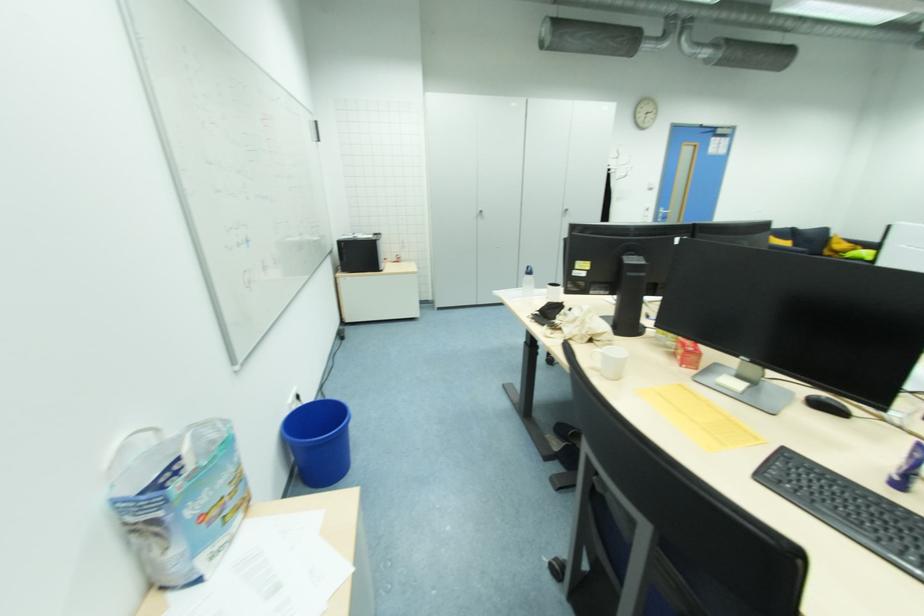
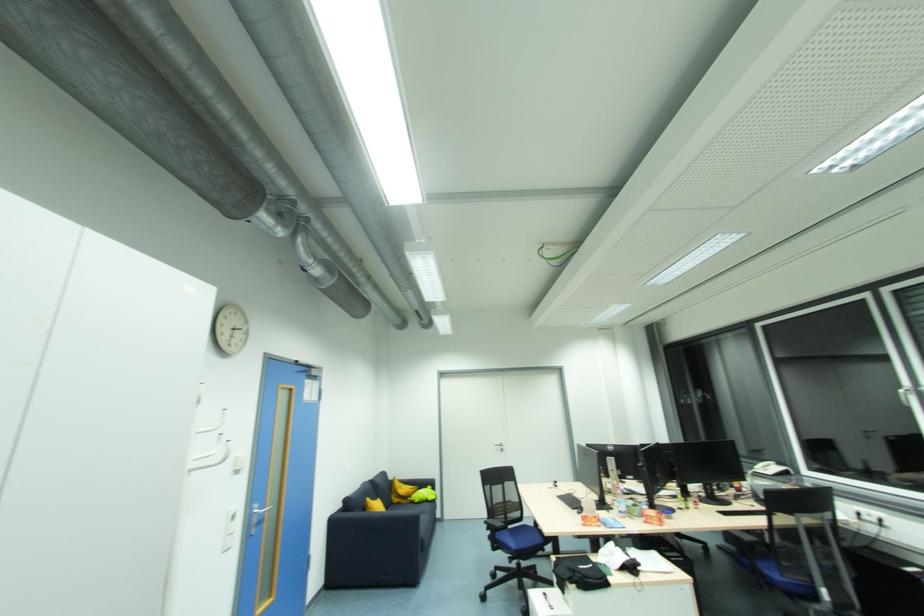
Where in the second image is the point corresponding to (x=831, y=257) from the first image?

(400, 505)